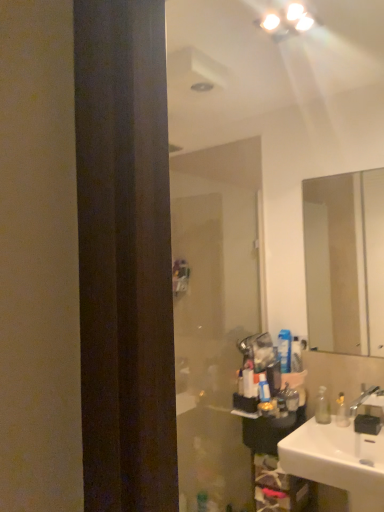
Question: From the image's perspective, relative to translucent plastic bottle at center, which ranks as the third toiletry in right-to-left order, is white glossy toothpaste tube at upper right, marked as the 2th toiletry in a front-to-back arrangement, above or below?

Choices:
 (A) above
 (B) below

Answer: (A)

Question: Considering the positions of white glossy toothpaste tube at upper right, which is the 1th toiletry from right to left, and translucent plastic bottle at center, which ranks as the third toiletry in right-to-left order, in the image, is white glossy toothpaste tube at upper right, which is the 1th toiletry from right to left, taller or shorter than translucent plastic bottle at center, which ranks as the third toiletry in right-to-left order,?

Choices:
 (A) short
 (B) tall

Answer: (B)

Question: Which object is positioned farthest from the transparent plastic bottle at right?

Choices:
 (A) silver metallic faucet at lower right
 (B) white glossy light fixture at upper center
 (C) translucent plastic shelf at lower right
 (D) white glossy toothpaste tube at upper right, which is the 1th toiletry from right to left
 (E) transparent plastic screen door at center

Answer: (B)

Question: Which object is positioned farthest from the translucent plastic bottle at center, which is the 1th toiletry in front-to-back order?

Choices:
 (A) translucent plastic shelf at lower right
 (B) silver metallic faucet at lower right
 (C) white glossy sink at lower right
 (D) clear glass mirror at upper right
 (E) white plastic toothpaste tube at right, positioned as the 2th toiletry in left-to-right order

Answer: (D)